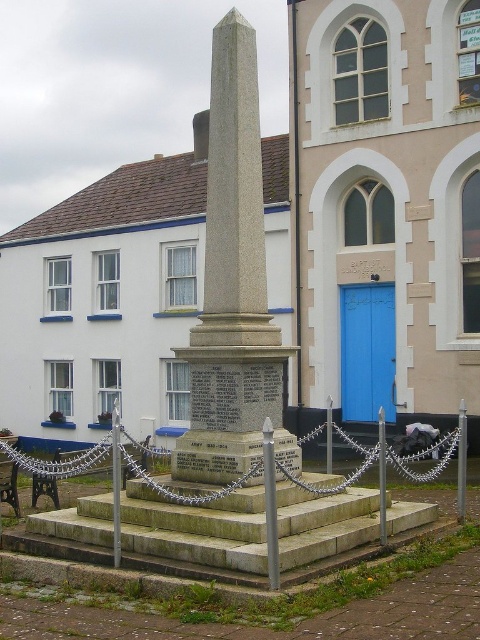
The width and height of the screenshot is (480, 640). Describe the element at coordinates (233, 288) in the screenshot. I see `granite obelisk at center` at that location.

Where is `granite obelisk at center`? The height and width of the screenshot is (640, 480). granite obelisk at center is located at coordinates (233, 288).

Locate an element on the screen. The width and height of the screenshot is (480, 640). granite obelisk at center is located at coordinates (233, 288).